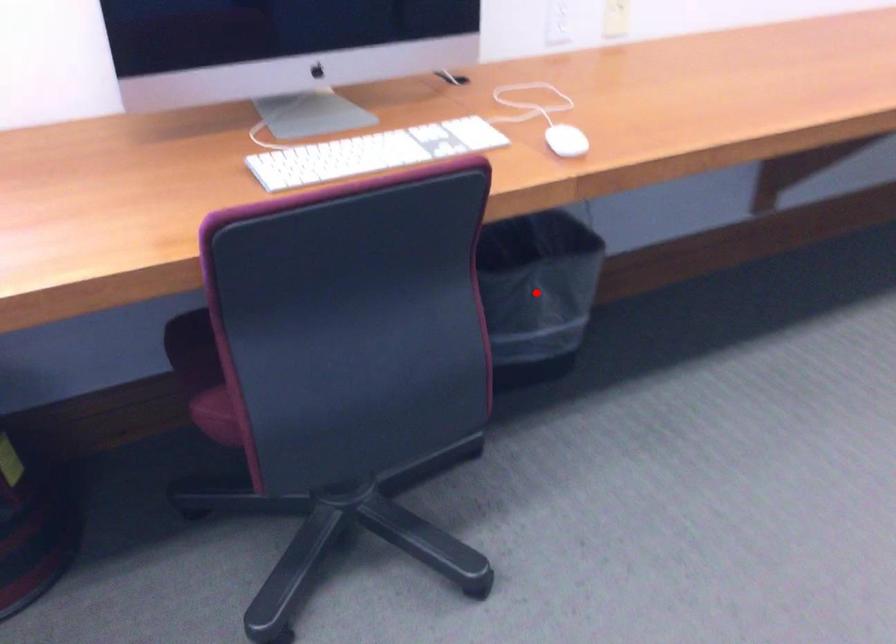
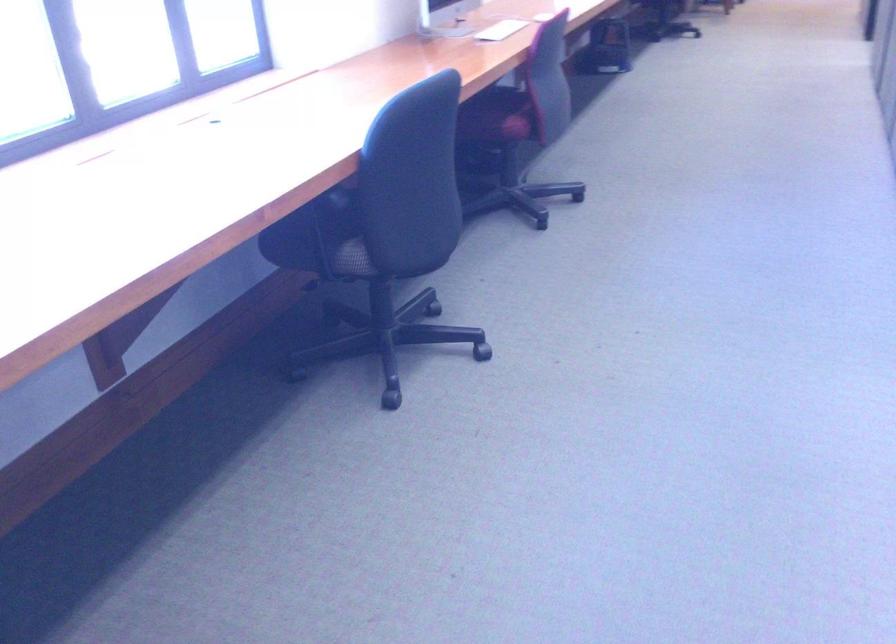
Question: I am providing you with two images of the same scene from different viewpoints. A red point is marked on the first image. Is the red point's position out of view in image 2?

Choices:
 (A) Yes
 (B) No

Answer: (A)